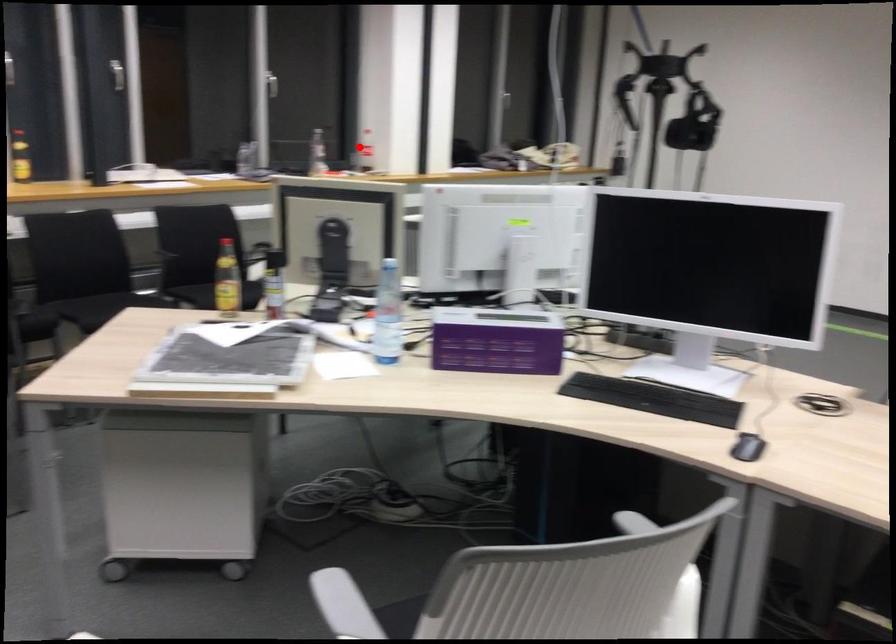
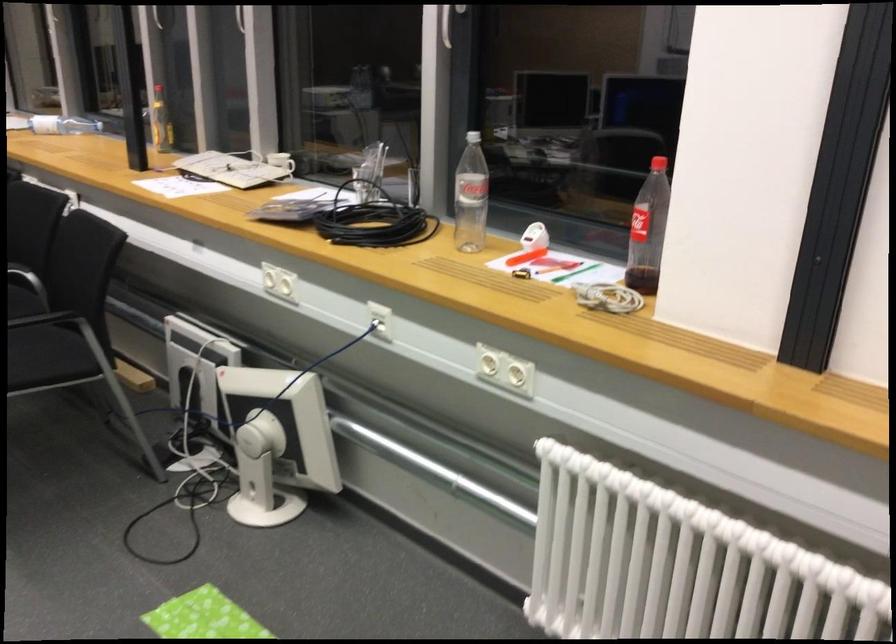
Question: I am providing you with two images of the same scene from different viewpoints. In image1, a red point is highlighted. Considering the same 3D point in image2, which of the following is correct?

Choices:
 (A) It is closer
 (B) It is farther

Answer: (A)